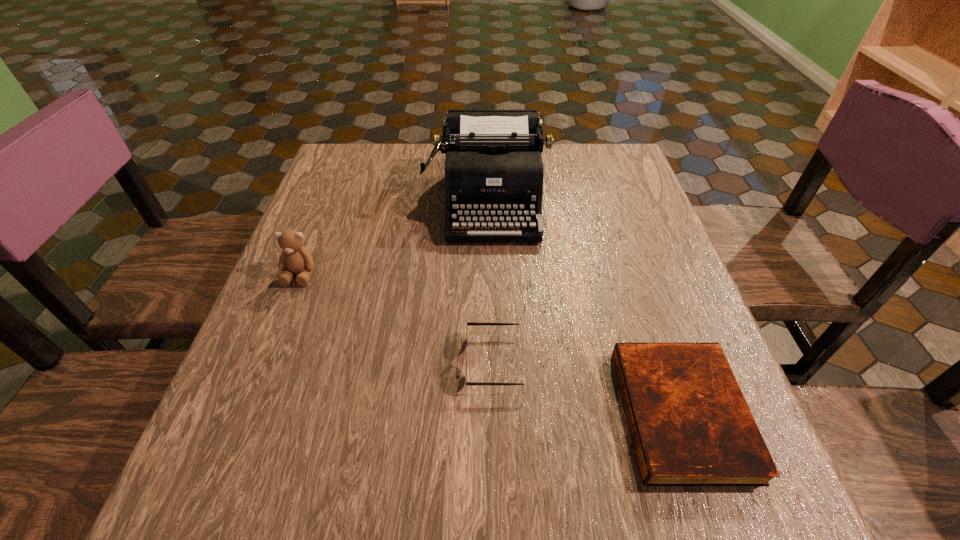
You are a GUI agent. You are given a task and a screenshot of the screen. Output one action in this format:
    pyautogui.click(x=<x>, y=<y>)
    Task: Click on the free space located on the front-facing side of the sunglasses
    This screenshot has width=960, height=540.
    Given the screenshot: What is the action you would take?
    pyautogui.click(x=371, y=361)

Identify the location of vacant space located 0.190m on the front-facing side of the sunglasses. (359, 361).

Where is `free space located on the spine side of the shortest object`? This screenshot has height=540, width=960. free space located on the spine side of the shortest object is located at coordinates (470, 414).

Locate an element on the screen. This screenshot has height=540, width=960. blank space located 0.170m on the spine side of the shortest object is located at coordinates (519, 414).

You are a GUI agent. You are given a task and a screenshot of the screen. Output one action in this format:
    pyautogui.click(x=<x>, y=<y>)
    Task: Click on the free space located on the spine side of the shortest object
    Image resolution: width=960 pixels, height=540 pixels.
    Given the screenshot: What is the action you would take?
    pyautogui.click(x=569, y=414)

Image resolution: width=960 pixels, height=540 pixels. In order to click on object situated at the far edge in this screenshot , I will do `click(494, 171)`.

This screenshot has height=540, width=960. In order to click on object that is at the near edge in this screenshot , I will do 690,425.

This screenshot has width=960, height=540. I want to click on object that is at the left edge, so click(295, 258).

Identify the location of object at the right edge. (690, 425).

Identify the location of object at the near right corner. (690, 425).